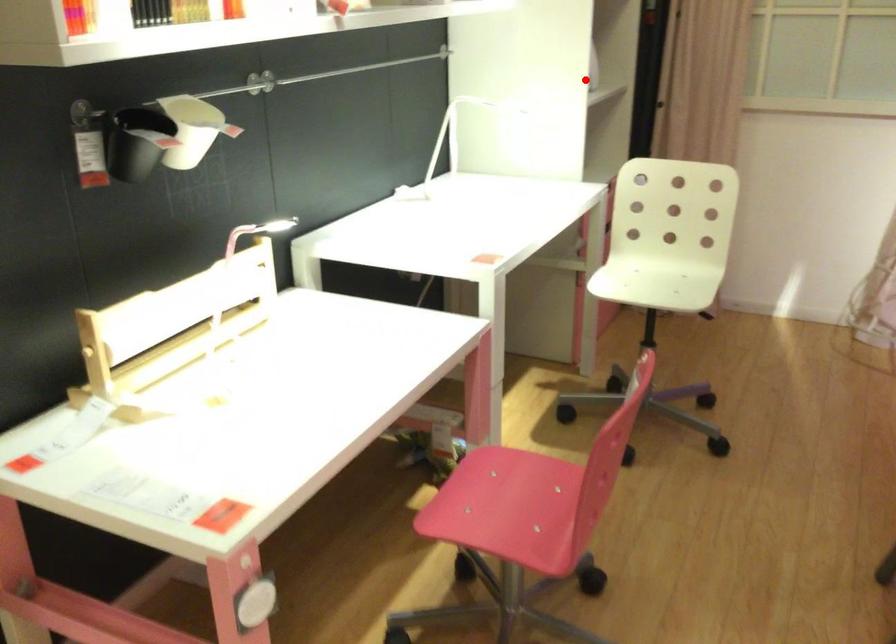
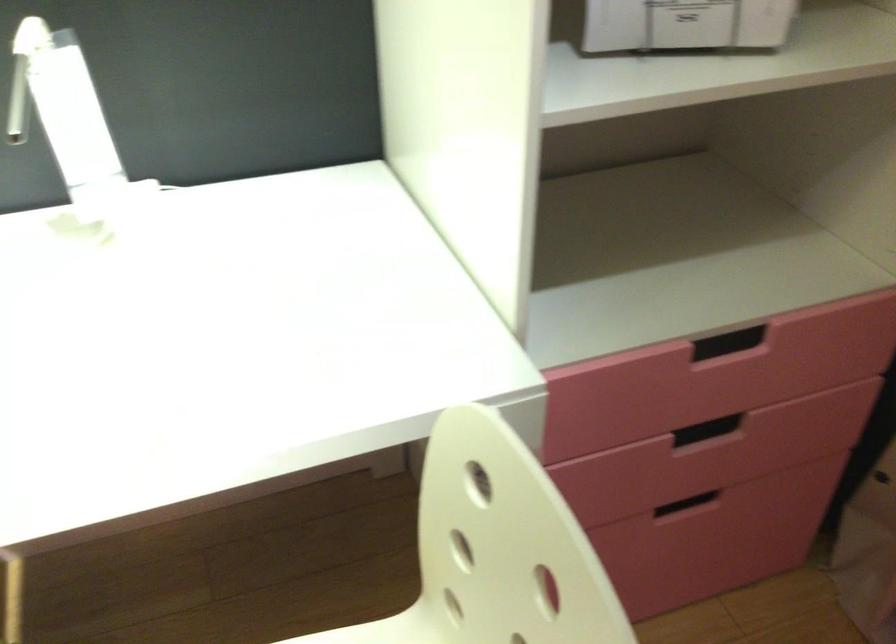
Find the pixel in the second image that matches the highlighted location in the first image.

(685, 24)